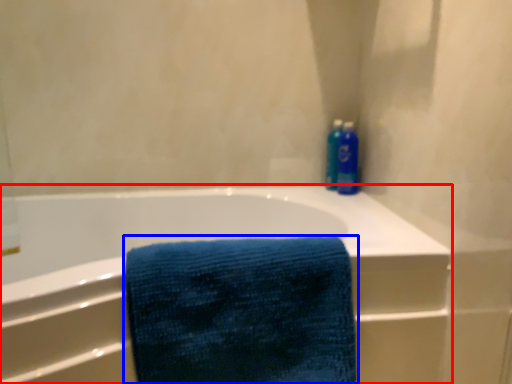
Question: Among these objects, which one is farthest to the camera, bathtub (highlighted by a red box) or towel (highlighted by a blue box)?

Choices:
 (A) bathtub
 (B) towel

Answer: (B)